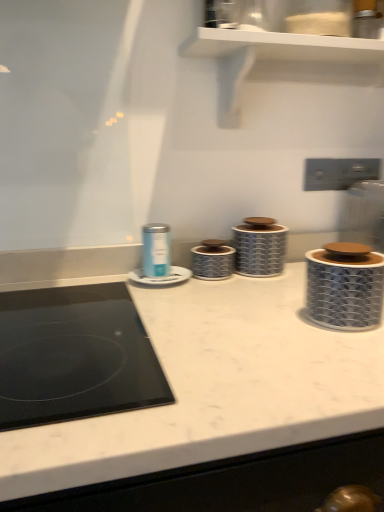
Question: Considering the positions of point (173, 268) and point (268, 274), is point (173, 268) closer or farther from the camera than point (268, 274)?

Choices:
 (A) farther
 (B) closer

Answer: (A)

Question: From the image's perspective, is matte blue canister at center, which is the second appliance in left-to-right order, positioned above or below blue and white ceramic canister at center, which appears as the fourth appliance when viewed from the left?

Choices:
 (A) below
 (B) above

Answer: (A)

Question: Estimate the real-world distances between objects in this image. Which object is closer to the blue and white ceramic canister at center, which appears as the fourth appliance when viewed from the left?

Choices:
 (A) silver textured canister at center, the 3th appliance viewed from the left
 (B) matte blue canister at center, which is the second appliance in left-to-right order
 (C) matte blue canister at center, which is counted as the 1th appliance, starting from the left
 (D) blue textured container at right, acting as the 1th appliance starting from the right

Answer: (A)

Question: Which object is positioned farthest from the matte blue canister at center, acting as the 4th appliance starting from the right?

Choices:
 (A) blue textured container at right, the fifth appliance from the left
 (B) blue and white ceramic canister at center, the second appliance when ordered from right to left
 (C) silver textured canister at center, the 3th appliance viewed from the left
 (D) matte blue canister at center, arranged as the fifth appliance when viewed from the right

Answer: (A)